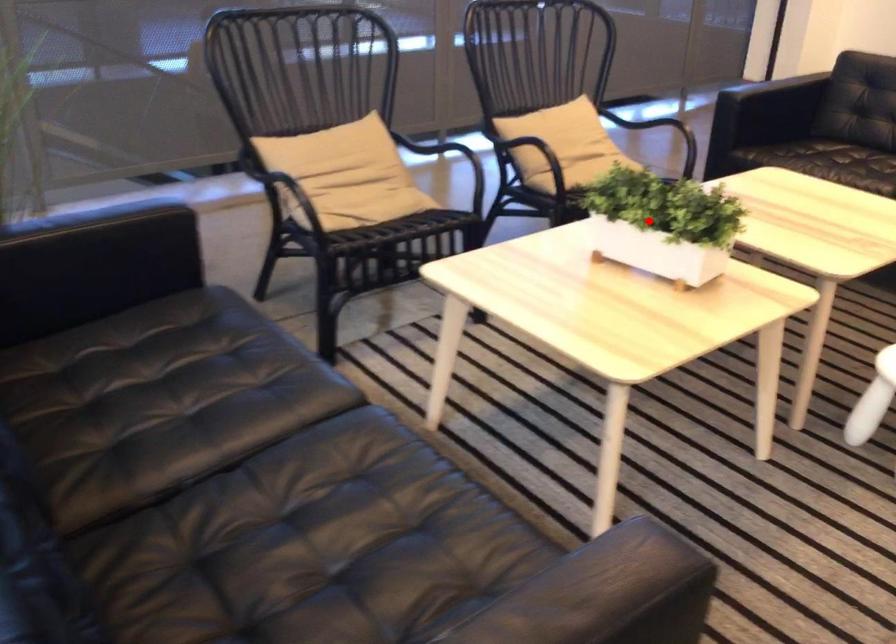
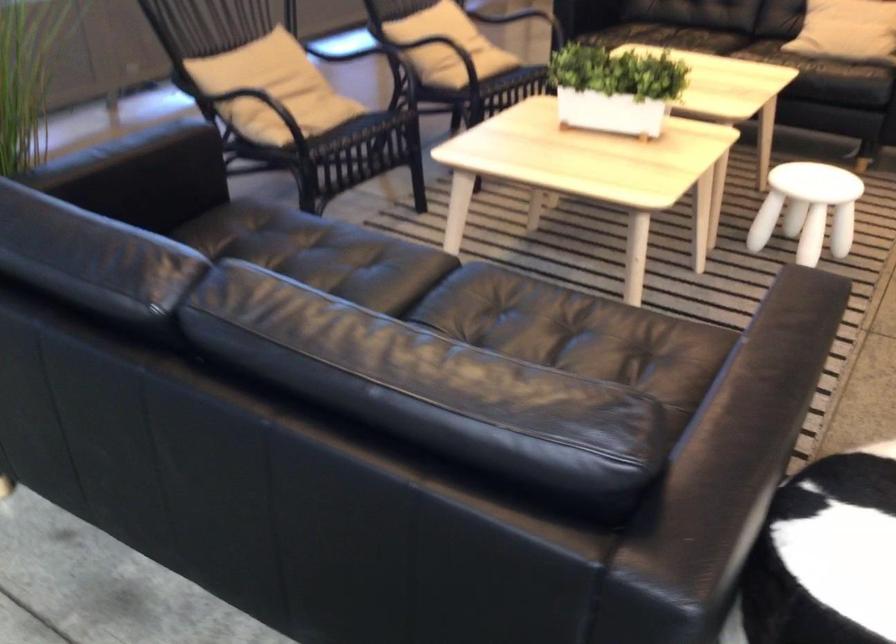
Question: I am providing you with two images of the same scene from different viewpoints. A red point is shown in image1. For the corresponding object point in image2, is it positioned nearer or farther from the camera?

Choices:
 (A) Nearer
 (B) Farther

Answer: (B)